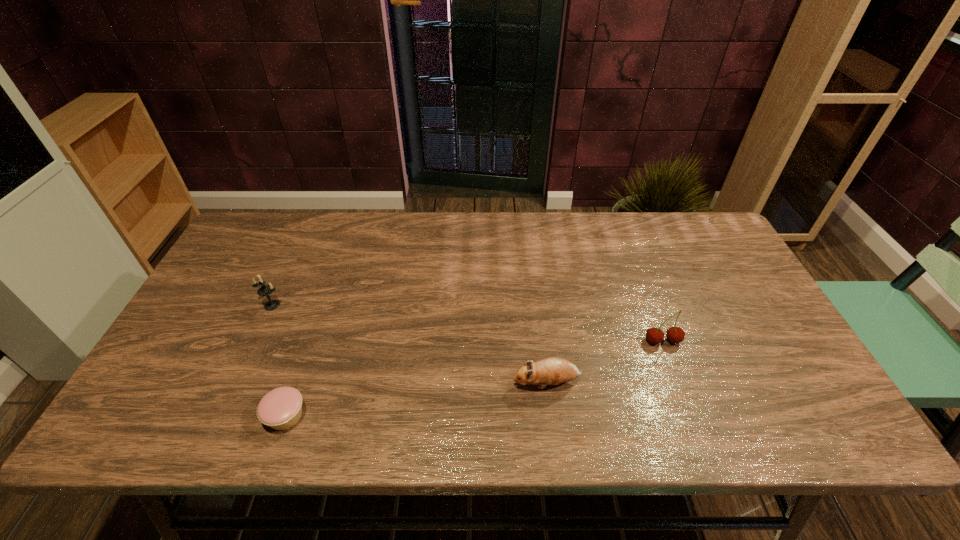
You are a GUI agent. You are given a task and a screenshot of the screen. Output one action in this format:
    pyautogui.click(x=<x>, y=<y>)
    Task: Click on the free space located at the face of the third tallest object
    This screenshot has width=960, height=540.
    Given the screenshot: What is the action you would take?
    pyautogui.click(x=419, y=383)

Identify the location of blank space located 0.120m at the face of the third tallest object. The image size is (960, 540). (461, 383).

Identify the location of vacant region located at the face of the third tallest object. (376, 383).

The image size is (960, 540). I want to click on free space located 0.110m on the right of the nearest object, so click(356, 416).

Locate an element on the screen. The image size is (960, 540). object at the near edge is located at coordinates (281, 408).

Identify the location of vacant space at the far edge of the desktop. The width and height of the screenshot is (960, 540). (597, 237).

Identify the location of vacant area at the near edge. The image size is (960, 540). (597, 422).

You are a GUI agent. You are given a task and a screenshot of the screen. Output one action in this format:
    pyautogui.click(x=<x>, y=<y>)
    Task: Click on the vacant space at the left edge of the desktop
    The width and height of the screenshot is (960, 540).
    Given the screenshot: What is the action you would take?
    pyautogui.click(x=206, y=296)

Identify the location of free location at the right edge. (816, 400).

Where is `vacant space at the far left corner of the desktop`? Image resolution: width=960 pixels, height=540 pixels. vacant space at the far left corner of the desktop is located at coordinates (247, 250).